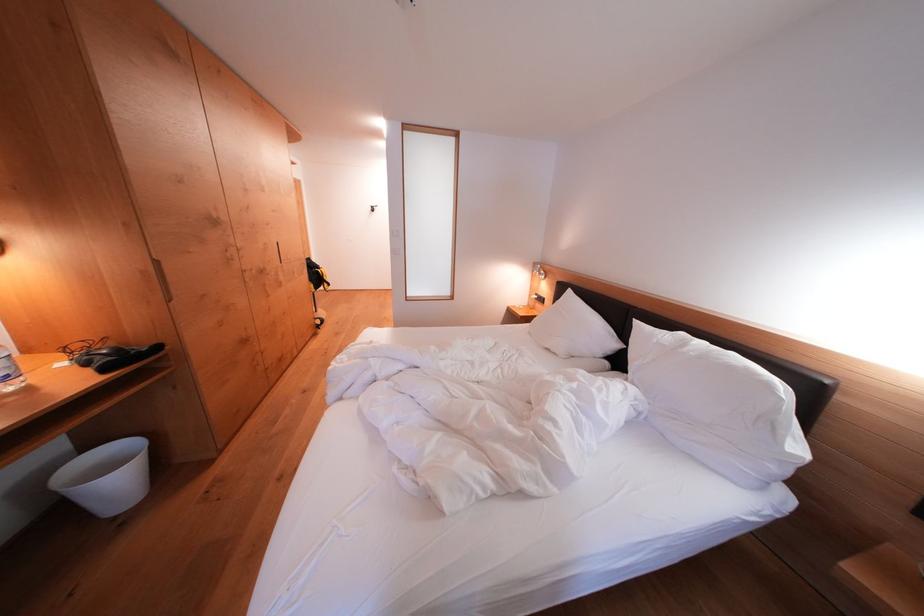
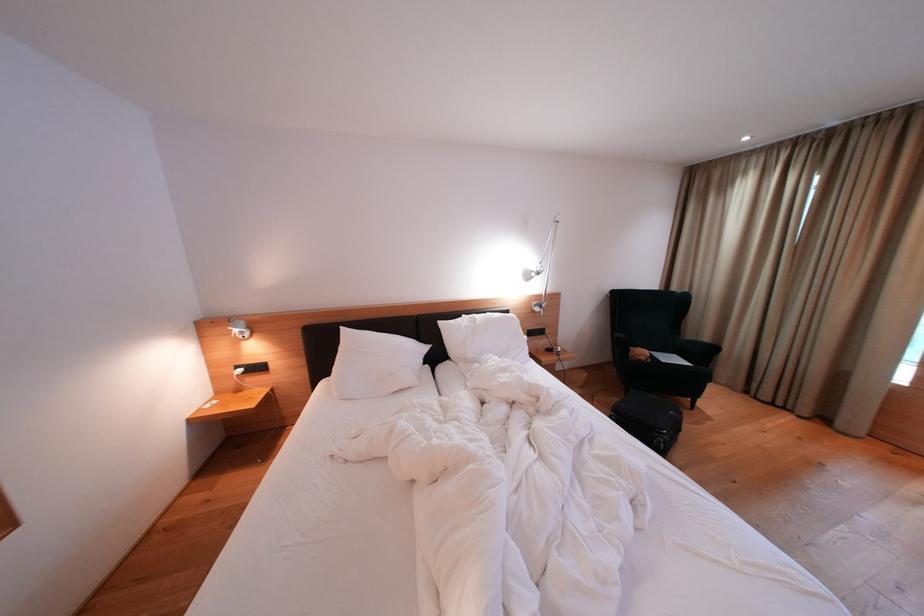
Find the pixel in the second image that matches (642,326) in the first image.

(447, 328)